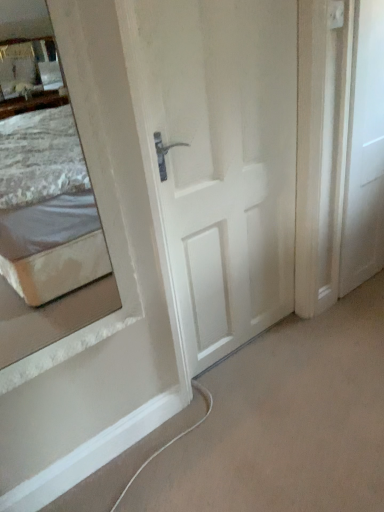
In order to face white matte door at right, which is counted as the 1th door, starting from the right, should I rotate leftwards or rightwards?

Turn right by 23.045 degrees to look at white matte door at right, which is counted as the 1th door, starting from the right.

Measure the distance between white matte door at right, which is counted as the 1th door, starting from the right, and camera.

5.09 feet.

The width and height of the screenshot is (384, 512). What are the coordinates of `white matte door at right, which is counted as the 1th door, starting from the right` in the screenshot? It's located at (364, 152).

Image resolution: width=384 pixels, height=512 pixels. Describe the element at coordinates (364, 152) in the screenshot. I see `white matte door at right, the second door from the left` at that location.

Describe the element at coordinates (222, 160) in the screenshot. The height and width of the screenshot is (512, 384). I see `white matte door at center, the second door when ordered from right to left` at that location.

The width and height of the screenshot is (384, 512). Find the location of `white matte door at center, the second door when ordered from right to left`. white matte door at center, the second door when ordered from right to left is located at coordinates (222, 160).

In order to face white matte door at center, the second door when ordered from right to left, should I rotate leftwards or rightwards?

Rotate your view right by about 5.765°.

I want to click on white matte door at right, which is counted as the 1th door, starting from the right, so click(364, 152).

Consider the image. Does white matte door at right, which is counted as the 1th door, starting from the right, appear on the left side of white matte door at center, the second door when ordered from right to left?

In fact, white matte door at right, which is counted as the 1th door, starting from the right, is to the right of white matte door at center, the second door when ordered from right to left.

Which object is closer to the camera taking this photo, white matte door at right, the second door from the left, or white matte door at center, the 1th door positioned from the left?

white matte door at center, the 1th door positioned from the left, is closer to the camera.

Does point (354, 194) come behind point (168, 30)?

That is True.

Consider the image. From the image's perspective, is white matte door at right, the second door from the left, above or below white matte door at center, the 1th door positioned from the left?

From the image's perspective, white matte door at right, the second door from the left, appears above white matte door at center, the 1th door positioned from the left.

From a real-world perspective, between white matte door at right, the second door from the left, and white matte door at center, the 1th door positioned from the left, who is vertically lower?

white matte door at right, the second door from the left, from a real-world perspective.

Does white matte door at right, the second door from the left, have a greater width compared to white matte door at center, the second door when ordered from right to left?

In fact, white matte door at right, the second door from the left, might be narrower than white matte door at center, the second door when ordered from right to left.

In terms of height, does white matte door at right, the second door from the left, look taller or shorter compared to white matte door at center, the second door when ordered from right to left?

In the image, white matte door at right, the second door from the left, appears to be shorter than white matte door at center, the second door when ordered from right to left.

Consider the image. Can you confirm if white matte door at right, the second door from the left, is smaller than white matte door at center, the 1th door positioned from the left?

Correct, white matte door at right, the second door from the left, occupies less space than white matte door at center, the 1th door positioned from the left.

Is white matte door at center, the second door when ordered from right to left, surrounded by white matte door at right, which is counted as the 1th door, starting from the right?

No, white matte door at center, the second door when ordered from right to left, is located outside of white matte door at right, which is counted as the 1th door, starting from the right.

Is white matte door at right, which is counted as the 1th door, starting from the right, far away from white matte door at center, the second door when ordered from right to left?

white matte door at right, which is counted as the 1th door, starting from the right, is actually quite close to white matte door at center, the second door when ordered from right to left.

Does white matte door at right, which is counted as the 1th door, starting from the right, turn towards white matte door at center, the 1th door positioned from the left?

No, white matte door at right, which is counted as the 1th door, starting from the right, is not aimed at white matte door at center, the 1th door positioned from the left.

Measure the distance from white matte door at right, which is counted as the 1th door, starting from the right, to white matte door at center, the 1th door positioned from the left.

They are 20.23 inches apart.

Identify the location of door above the white matte door at right, the second door from the left (from a real-world perspective). Image resolution: width=384 pixels, height=512 pixels. (222, 160).

Is white matte door at center, the second door when ordered from right to left, to the right of white matte door at right, the second door from the left, from the viewer's perspective?

Result: No.

From the picture: Is white matte door at center, the second door when ordered from right to left, further to camera compared to white matte door at right, which is counted as the 1th door, starting from the right?

No.

Considering the positions of points (293, 163) and (363, 47), is point (293, 163) closer to camera compared to point (363, 47)?

No.

From the image's perspective, which is above, white matte door at center, the 1th door positioned from the left, or white matte door at right, the second door from the left?

white matte door at right, the second door from the left, is shown above in the image.

From a real-world perspective, relative to white matte door at right, the second door from the left, is white matte door at center, the 1th door positioned from the left, vertically above or below?

In terms of real-world spatial position, white matte door at center, the 1th door positioned from the left, is above white matte door at right, the second door from the left.

Is white matte door at center, the 1th door positioned from the left, wider than white matte door at right, the second door from the left?

Indeed, white matte door at center, the 1th door positioned from the left, has a greater width compared to white matte door at right, the second door from the left.

Is white matte door at center, the 1th door positioned from the left, shorter than white matte door at right, which is counted as the 1th door, starting from the right?

In fact, white matte door at center, the 1th door positioned from the left, may be taller than white matte door at right, which is counted as the 1th door, starting from the right.

Considering the sizes of white matte door at center, the 1th door positioned from the left, and white matte door at right, which is counted as the 1th door, starting from the right, in the image, is white matte door at center, the 1th door positioned from the left, bigger or smaller than white matte door at right, which is counted as the 1th door, starting from the right,?

Considering their sizes, white matte door at center, the 1th door positioned from the left, takes up more space than white matte door at right, which is counted as the 1th door, starting from the right.

Is white matte door at center, the second door when ordered from right to left, located outside white matte door at right, the second door from the left?

That's correct, white matte door at center, the second door when ordered from right to left, is outside of white matte door at right, the second door from the left.

Is white matte door at center, the 1th door positioned from the left, touching white matte door at right, the second door from the left?

No.

Is white matte door at center, the 1th door positioned from the left, facing towards white matte door at right, which is counted as the 1th door, starting from the right?

No, white matte door at center, the 1th door positioned from the left, is not oriented towards white matte door at right, which is counted as the 1th door, starting from the right.

What's the angular difference between white matte door at center, the second door when ordered from right to left, and white matte door at right, which is counted as the 1th door, starting from the right,'s facing directions?

The facing directions of white matte door at center, the second door when ordered from right to left, and white matte door at right, which is counted as the 1th door, starting from the right, are 0.344 degrees apart.

The image size is (384, 512). I want to click on door directly beneath the white matte door at center, the 1th door positioned from the left (from a real-world perspective), so click(x=364, y=152).

This screenshot has width=384, height=512. Find the location of `door on the right of white matte door at center, the 1th door positioned from the left`. door on the right of white matte door at center, the 1th door positioned from the left is located at coordinates (364, 152).

What are the coordinates of `door that appears behind the white matte door at center, the second door when ordered from right to left` in the screenshot? It's located at (364, 152).